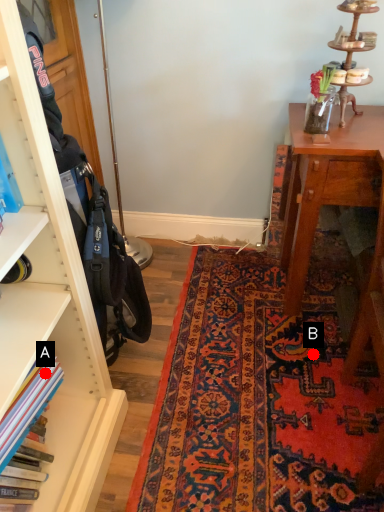
Question: Two points are circled on the image, labeled by A and B beside each circle. Which of the following is the farthest from the observer?

Choices:
 (A) A is further
 (B) B is further

Answer: (B)